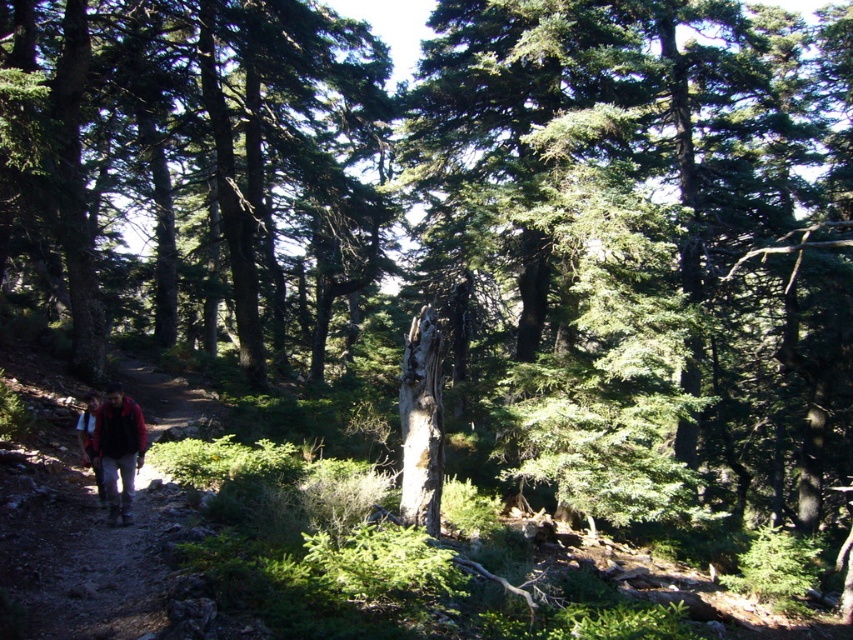
Describe the element at coordinates (190, 163) in the screenshot. I see `green rough bark tree at center` at that location.

Is point (369, 216) positioned behind point (96, 403)?

Yes, it is behind point (96, 403).

This screenshot has height=640, width=853. Identify the location of green rough bark tree at center. (190, 163).

Image resolution: width=853 pixels, height=640 pixels. What are the coordinates of `green rough bark tree at center` in the screenshot? It's located at (190, 163).

Does dirt path at lower left come in front of red plaid shirt at lower left?

That is True.

Is dirt path at lower left to the right of red plaid shirt at lower left from the viewer's perspective?

No, dirt path at lower left is not to the right of red plaid shirt at lower left.

This screenshot has width=853, height=640. I want to click on dirt path at lower left, so click(x=80, y=541).

Who is more distant from viewer, (x=163, y=534) or (x=129, y=417)?

The point (x=129, y=417) is behind.

Is dirt path at lower left above red jacket at left?

Incorrect, dirt path at lower left is not positioned above red jacket at left.

Describe the element at coordinates (80, 541) in the screenshot. The width and height of the screenshot is (853, 640). I see `dirt path at lower left` at that location.

In order to click on dirt path at lower left in this screenshot , I will do `click(80, 541)`.